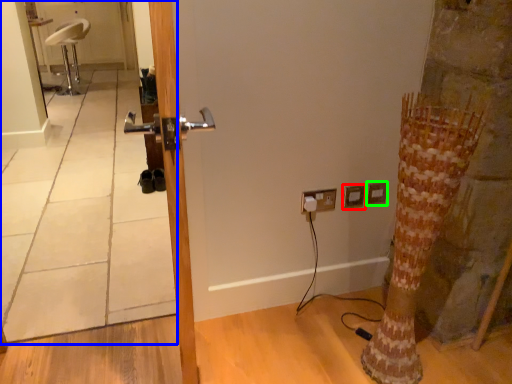
Question: Which object is positioned farthest from electric outlet (highlighted by a red box)? Select from mirror (highlighted by a blue box) and electric outlet (highlighted by a green box).

Choices:
 (A) mirror
 (B) electric outlet

Answer: (A)